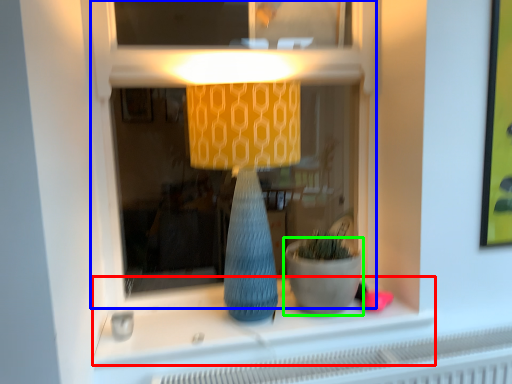
Question: Which object is the farthest from window sill (highlighted by a red box)? Choose among these: shop window (highlighted by a blue box) or flowerpot (highlighted by a green box).

Choices:
 (A) shop window
 (B) flowerpot

Answer: (A)